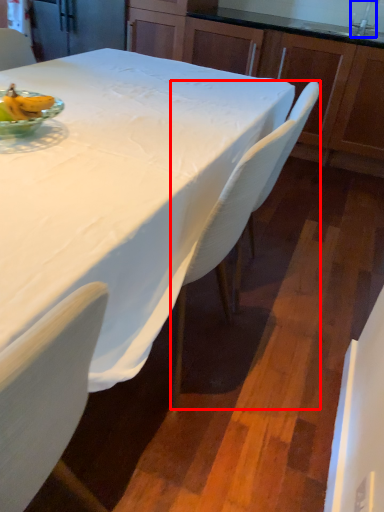
Question: Which object is further to the camera taking this photo, chair (highlighted by a red box) or faucet (highlighted by a blue box)?

Choices:
 (A) chair
 (B) faucet

Answer: (B)